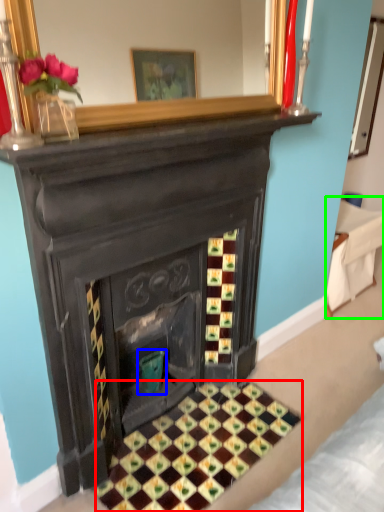
Question: Which object is the farthest from pattern (highlighted by a red box)? Choose among these: teal (highlighted by a blue box) or furniture (highlighted by a green box).

Choices:
 (A) teal
 (B) furniture

Answer: (B)